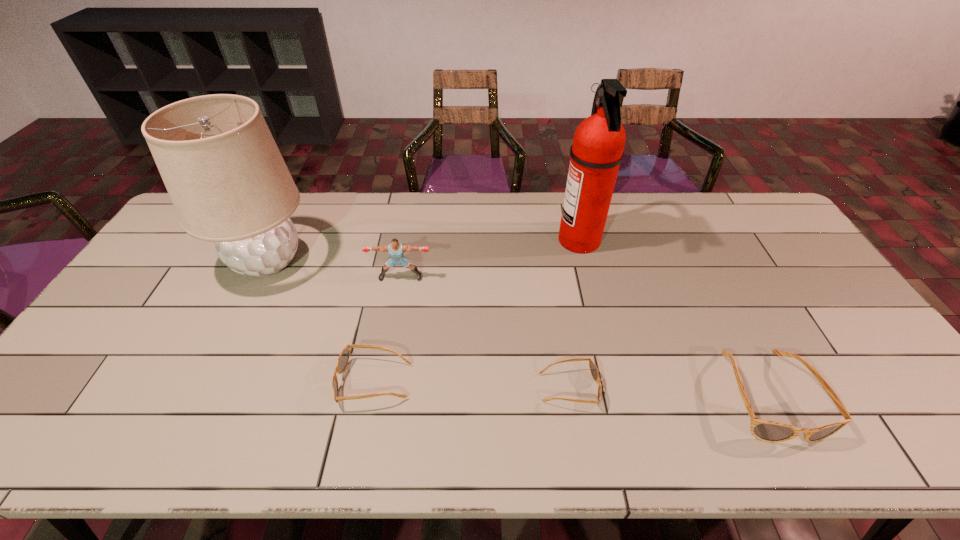
Locate an element on the screen. vacant space that's between the fourth shortest object and the leftmost sunglasses is located at coordinates (388, 329).

I want to click on free space between the leftmost sunglasses and the second sunglasses from right to left, so click(471, 385).

Find the location of a particular element. vacant area between the third tallest object and the leftmost object is located at coordinates pos(334,269).

The height and width of the screenshot is (540, 960). In order to click on object that is the fifth closest to the puncher in this screenshot , I will do `click(768, 431)`.

Where is `object that is the closest to the fire extinguisher`? This screenshot has height=540, width=960. object that is the closest to the fire extinguisher is located at coordinates (593, 368).

I want to click on sunglasses that is the closest to the second tallest sunglasses, so click(x=593, y=368).

Identify the location of sunglasses that is the closest to the fire extinguisher. (593, 368).

You are a GUI agent. You are given a task and a screenshot of the screen. Output one action in this format:
    pyautogui.click(x=<x>, y=<y>)
    Task: Click on the free space in the image that satisfies the following two spatial constraints: 1. on the side of the fire extinguisher near the handle; 2. on the front-facing side of the fourth shortest object
    
    Given the screenshot: What is the action you would take?
    pyautogui.click(x=588, y=277)

The image size is (960, 540). In order to click on free region that satisfies the following two spatial constraints: 1. on the side of the fire extinguisher near the handle; 2. on the front-facing side of the puncher in this screenshot , I will do `click(588, 277)`.

Where is `free space that satisfies the following two spatial constraints: 1. on the side of the fire extinguisher near the handle; 2. on the front-facing side of the fourth shortest object`? free space that satisfies the following two spatial constraints: 1. on the side of the fire extinguisher near the handle; 2. on the front-facing side of the fourth shortest object is located at coordinates (588, 277).